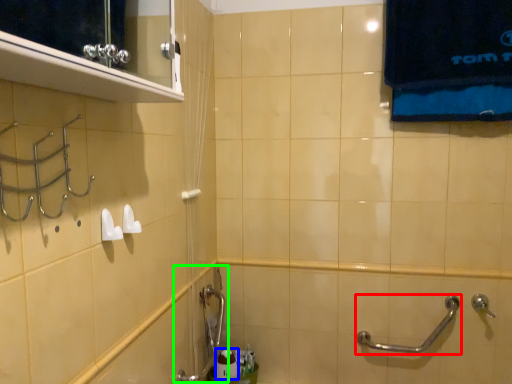
Question: Which object is positioned farthest from door handle (highlighted by a red box)? Select from toiletry (highlighted by a blue box) and plumbing fixture (highlighted by a green box).

Choices:
 (A) toiletry
 (B) plumbing fixture

Answer: (B)